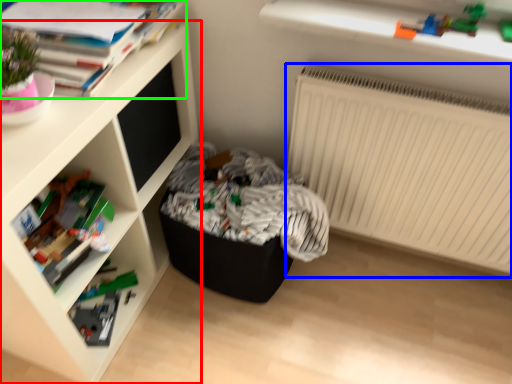
Question: Estimate the real-world distances between objects in this image. Which object is farther from shelf (highlighted by a red box), radiator (highlighted by a blue box) or book (highlighted by a green box)?

Choices:
 (A) radiator
 (B) book

Answer: (A)